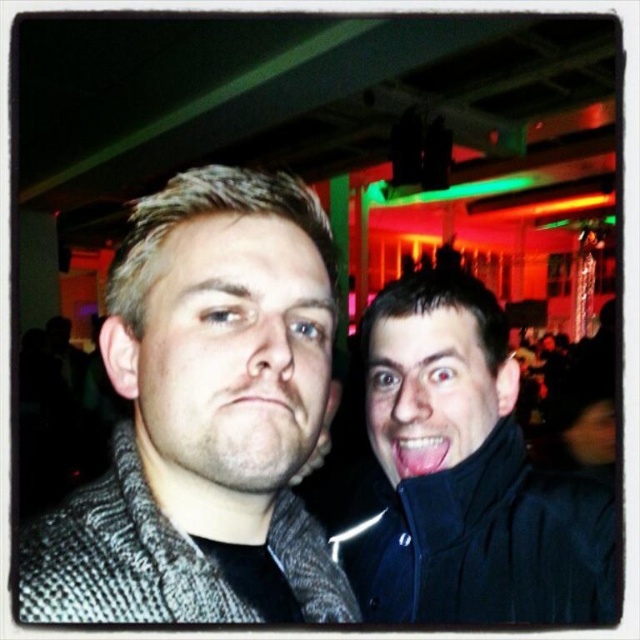
You are a photographer at the event and need to frame a closeup shot of both the black matte jacket at right and the pink matte lips at center. Since the camera has limited space in the frame, can you fit both objects in the same shot without cropping either of them?

The black matte jacket at right is wider than the pink matte lips at center, so it should be possible to fit both in the frame as long as the camera is positioned to accommodate the wider jacket.

You are a photographer trying to capture a clear shot of both the matte gray coat at center and the smooth skin face at right. Since the camera can only focus on one subject at a time, which subject should you prioritize focusing on to ensure it appears sharp in the photo?

The matte gray coat at center should be prioritized for focus because it is closer to the viewer than the smooth skin face at right, and cameras typically focus on the nearest subject for sharpness.